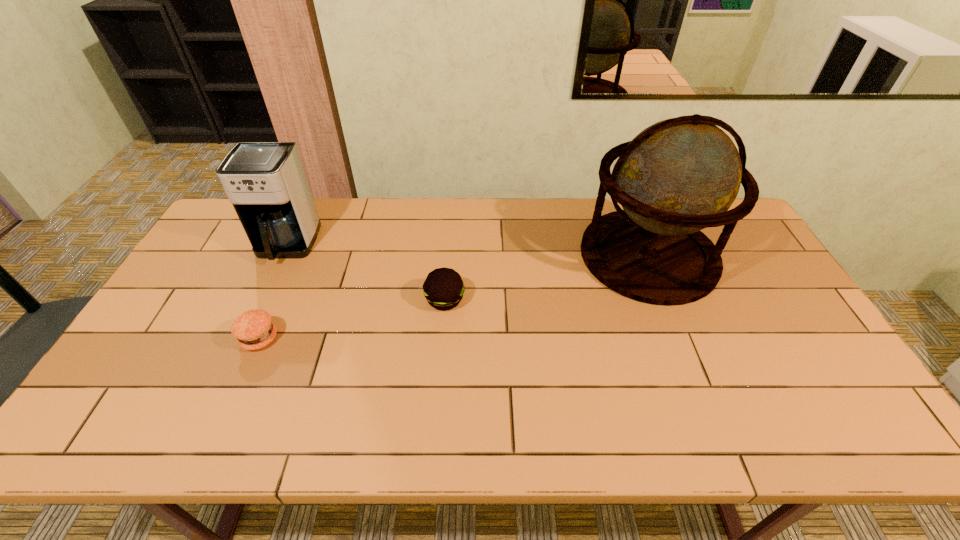
Locate an element on the screen. The image size is (960, 540). the third closest object to the globe is located at coordinates (266, 182).

Identify which object is the nearest to the rightmost object. Please provide its 2D coordinates. Your answer should be formatted as a tuple, i.e. [(x, y)], where the tuple contains the x and y coordinates of a point satisfying the conditions above.

[(443, 288)]

At what (x,y) coordinates should I click in order to perform the action: click on vacant space that satisfies the following two spatial constraints: 1. on the front panel of the right patty; 2. on the left side of the coffee maker. Please return your answer as a coordinate pair (x, y). This screenshot has height=540, width=960. Looking at the image, I should click on (261, 300).

This screenshot has height=540, width=960. In order to click on vacant region that satisfies the following two spatial constraints: 1. on the back side of the shortest object; 2. on the right side of the second object from right to left in this screenshot , I will do [x=276, y=300].

Where is `free location that satisfies the following two spatial constraints: 1. on the front-facing side of the globe; 2. on the front side of the second object from right to left`? The height and width of the screenshot is (540, 960). free location that satisfies the following two spatial constraints: 1. on the front-facing side of the globe; 2. on the front side of the second object from right to left is located at coordinates (666, 300).

The height and width of the screenshot is (540, 960). Find the location of `free space that satisfies the following two spatial constraints: 1. on the back side of the left patty; 2. on the right side of the second object from right to left`. free space that satisfies the following two spatial constraints: 1. on the back side of the left patty; 2. on the right side of the second object from right to left is located at coordinates (276, 300).

Where is `vacant region that satisfies the following two spatial constraints: 1. on the front panel of the coffee maker; 2. on the left side of the taller patty`? This screenshot has width=960, height=540. vacant region that satisfies the following two spatial constraints: 1. on the front panel of the coffee maker; 2. on the left side of the taller patty is located at coordinates (261, 300).